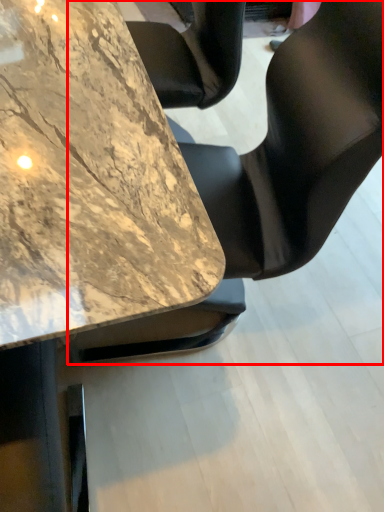
Question: In this image, where is chair (annotated by the red box) located relative to table?

Choices:
 (A) right
 (B) left

Answer: (A)